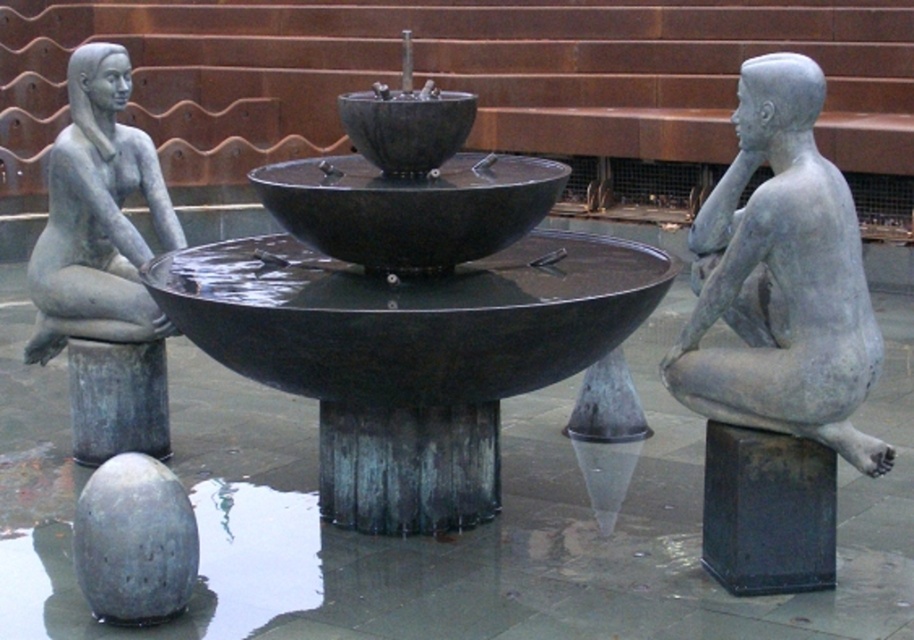
What is located at the coordinates point (117,400) in the sculpture?

At point (117,400) lies bronze textured pillar at left.

From the picture: What are the coordinates of the bronze textured pillar at left?

The bronze textured pillar at left is located at coordinates point (x=117, y=400).

You are standing in front of the sculpture garden and want to take a photo of the matte gray statue at right. If your camera has a maximum focus range of 8 meters, will it be able to capture the statue clearly?

The matte gray statue at right is 7.64 meters away from the camera, which is within the 8 meters maximum focus range. Therefore, the camera can capture the statue clearly.